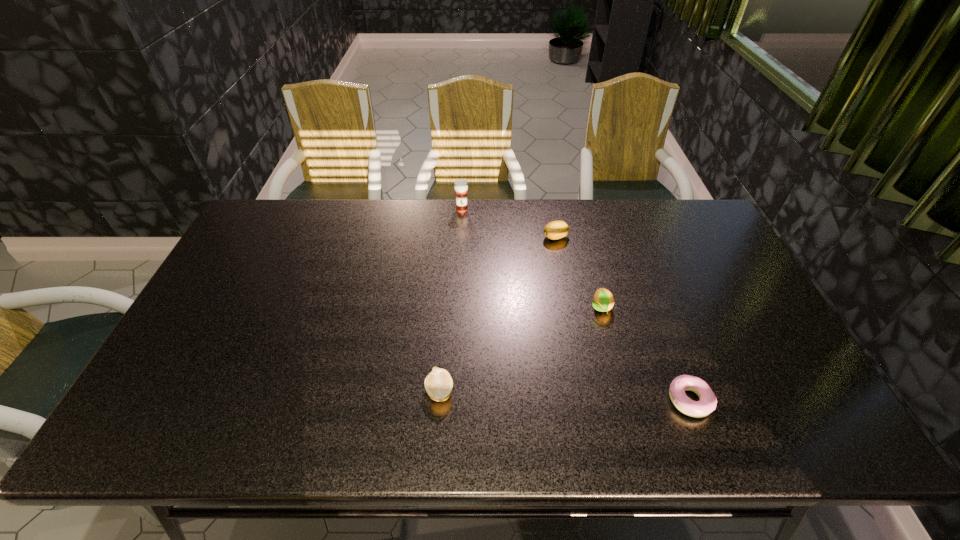
The height and width of the screenshot is (540, 960). In order to click on the tallest object in this screenshot , I will do `click(460, 186)`.

Find the location of `medicine`. medicine is located at coordinates pos(460,186).

Image resolution: width=960 pixels, height=540 pixels. I want to click on the third object from right to left, so click(x=557, y=229).

Where is `the farthest lemon`? The image size is (960, 540). the farthest lemon is located at coordinates (557, 229).

The width and height of the screenshot is (960, 540). Identify the location of the second object from right to left. (603, 301).

Identify the location of the third farthest object. The width and height of the screenshot is (960, 540). (603, 301).

Find the location of a particular element. This screenshot has width=960, height=540. doughnut is located at coordinates (707, 402).

The width and height of the screenshot is (960, 540). Identify the location of the nearest lemon. (438, 383).

What are the coordinates of `the shortest lemon` in the screenshot? It's located at (438, 383).

Image resolution: width=960 pixels, height=540 pixels. I want to click on vacant space positioned 0.260m on the label side of the farthest object, so click(459, 264).